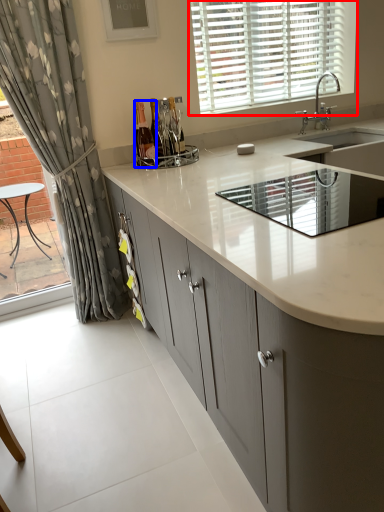
Question: Which object appears closest to the camera in this image, window (highlighted by a red box) or bottle (highlighted by a blue box)?

Choices:
 (A) window
 (B) bottle

Answer: (B)